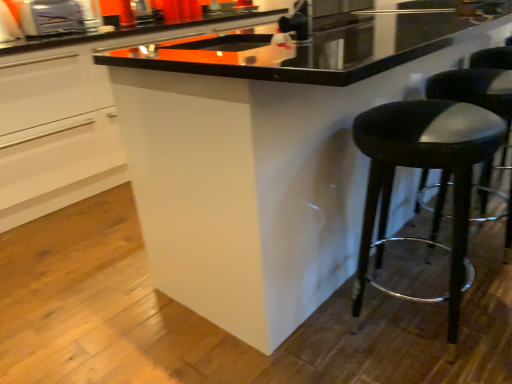
Question: In terms of size, does black leather stool at right appear bigger or smaller than black leather stool at lower right?

Choices:
 (A) small
 (B) big

Answer: (B)

Question: From a real-world perspective, is black leather stool at right physically located above or below black leather stool at lower right?

Choices:
 (A) below
 (B) above

Answer: (A)

Question: Which of these objects is positioned closest to the black leather stool at lower right?

Choices:
 (A) white glossy cabinet at center
 (B) black leather stool at right
 (C) metallic silver toaster at upper left

Answer: (B)

Question: Which is nearer to the black leather stool at lower right?

Choices:
 (A) white glossy cabinet at center
 (B) metallic silver toaster at upper left
 (C) black leather stool at right

Answer: (C)